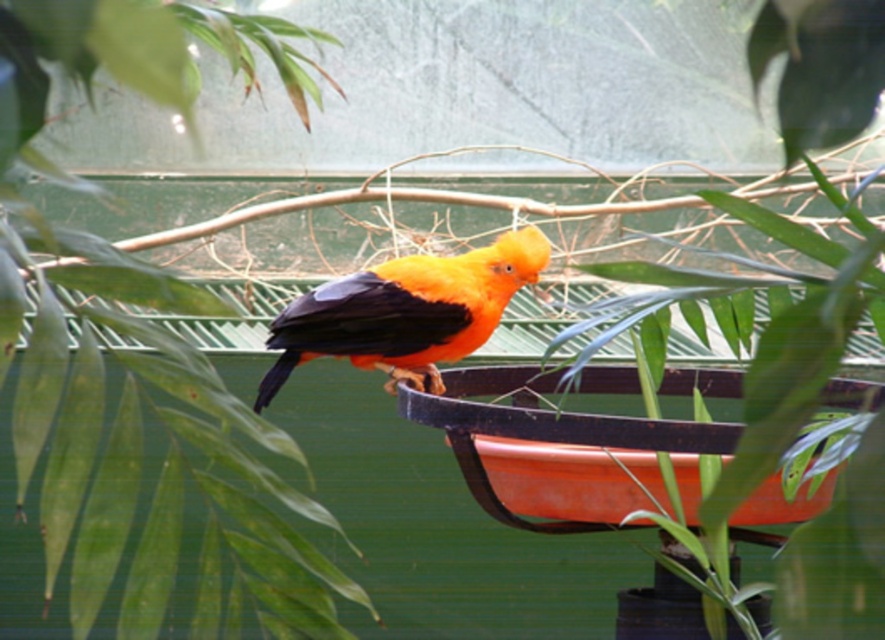
You are a GUI agent. You are given a task and a screenshot of the screen. Output one action in this format:
    pyautogui.click(x=<x>, y=<y>)
    Task: Click on the green leafy plant at upper left
    The image size is (885, 640).
    Given the screenshot: What is the action you would take?
    pyautogui.click(x=95, y=193)

Between point (74, 604) and point (405, 305), which one is positioned in front?

Positioned in front is point (74, 604).

Between point (145, 84) and point (373, 289), which one is positioned behind?

The point (373, 289) is more distant.

This screenshot has width=885, height=640. What are the coordinates of `green leafy plant at upper left` in the screenshot? It's located at (95, 193).